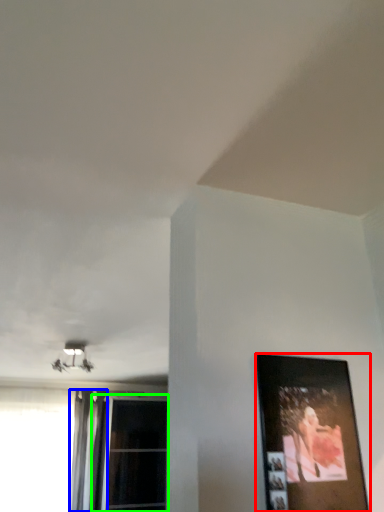
Question: Which object is the closest to the picture frame (highlighted by a red box)? Choose among these: curtain (highlighted by a blue box) or window (highlighted by a green box).

Choices:
 (A) curtain
 (B) window

Answer: (A)